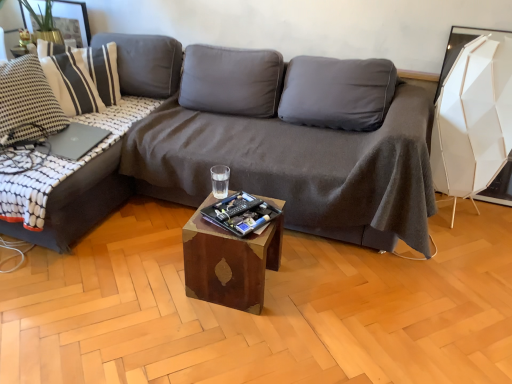
What is the approximate height of slate gray matte laptop at left?

slate gray matte laptop at left is 2.21 inches in height.

Locate an element on the screen. This screenshot has height=384, width=512. slate gray matte laptop at left is located at coordinates (73, 141).

Describe the element at coordinates (79, 202) in the screenshot. I see `dark gray fabric couch at left, the 2th studio couch when ordered from right to left` at that location.

This screenshot has height=384, width=512. I want to click on dark gray fabric couch at left, the 2th studio couch when ordered from right to left, so click(x=79, y=202).

Locate an element on the screen. The width and height of the screenshot is (512, 384). white textured pillow at upper left is located at coordinates (93, 66).

Describe the element at coordinates (229, 262) in the screenshot. This screenshot has height=384, width=512. I see `wooden cube at center` at that location.

This screenshot has width=512, height=384. I want to click on slate gray matte laptop at left, so click(73, 141).

Looking at this image, is dark gray fabric couch at left, arranged as the first studio couch when viewed from the left, positioned in front of green leafy plant at upper left?

Yes, the depth of dark gray fabric couch at left, arranged as the first studio couch when viewed from the left, is less than that of green leafy plant at upper left.

From the image's perspective, which one is positioned lower, dark gray fabric couch at left, the 2th studio couch when ordered from right to left, or green leafy plant at upper left?

From the image's view, dark gray fabric couch at left, the 2th studio couch when ordered from right to left, is below.

Considering the sizes of dark gray fabric couch at left, the 2th studio couch when ordered from right to left, and green leafy plant at upper left in the image, is dark gray fabric couch at left, the 2th studio couch when ordered from right to left, wider or thinner than green leafy plant at upper left?

Clearly, dark gray fabric couch at left, the 2th studio couch when ordered from right to left, has more width compared to green leafy plant at upper left.

Are dark gray fabric couch at left, the 2th studio couch when ordered from right to left, and white textured pillow at upper left beside each other?

No, dark gray fabric couch at left, the 2th studio couch when ordered from right to left, is not making contact with white textured pillow at upper left.

Between point (62, 251) and point (47, 42), which one is positioned behind?

The point (47, 42) is behind.

Who is bigger, dark gray fabric couch at left, the 2th studio couch when ordered from right to left, or white textured pillow at upper left?

With larger size is dark gray fabric couch at left, the 2th studio couch when ordered from right to left.

Between dark gray fabric couch at left, arranged as the first studio couch when viewed from the left, and white textured pillow at upper left, which one has more height?

With more height is dark gray fabric couch at left, arranged as the first studio couch when viewed from the left.

Considering the sizes of dark gray fabric couch at center, placed as the 1th studio couch when sorted from right to left, and slate gray matte laptop at left in the image, is dark gray fabric couch at center, placed as the 1th studio couch when sorted from right to left, taller or shorter than slate gray matte laptop at left?

dark gray fabric couch at center, placed as the 1th studio couch when sorted from right to left, is taller than slate gray matte laptop at left.

Is point (385, 62) in front of point (91, 127)?

That is False.

From a real-world perspective, relative to slate gray matte laptop at left, is dark gray fabric couch at center, placed as the 1th studio couch when sorted from right to left, vertically above or below?

From a real-world perspective, dark gray fabric couch at center, placed as the 1th studio couch when sorted from right to left, is physically below slate gray matte laptop at left.

Consider the image. Can you confirm if dark gray fabric couch at center, placed as the second studio couch when sorted from left to right, is positioned to the left of slate gray matte laptop at left?

In fact, dark gray fabric couch at center, placed as the second studio couch when sorted from left to right, is to the right of slate gray matte laptop at left.

Based on the photo, does white textured pillow at upper left touch dark gray fabric couch at left, the 2th studio couch when ordered from right to left?

They are not placed beside each other.

Which of these two, white textured pillow at upper left or dark gray fabric couch at left, arranged as the first studio couch when viewed from the left, is thinner?

Thinner between the two is white textured pillow at upper left.

Is the position of white textured pillow at upper left more distant than that of dark gray fabric couch at left, the 2th studio couch when ordered from right to left?

Yes.

Where is `studio couch that is the 1st one when counting downward from the white textured pillow at upper left (from the image's perspective)`? Image resolution: width=512 pixels, height=384 pixels. studio couch that is the 1st one when counting downward from the white textured pillow at upper left (from the image's perspective) is located at coordinates (79, 202).

Is point (239, 160) behind point (151, 92)?

That is False.

From the image's perspective, is dark gray fabric couch at center, placed as the 1th studio couch when sorted from right to left, above or below dark gray fabric couch at left, arranged as the first studio couch when viewed from the left?

Clearly, from the image's perspective, dark gray fabric couch at center, placed as the 1th studio couch when sorted from right to left, is below dark gray fabric couch at left, arranged as the first studio couch when viewed from the left.

How many degrees apart are the facing directions of dark gray fabric couch at center, placed as the second studio couch when sorted from left to right, and dark gray fabric couch at left, the 2th studio couch when ordered from right to left?

The facing directions of dark gray fabric couch at center, placed as the second studio couch when sorted from left to right, and dark gray fabric couch at left, the 2th studio couch when ordered from right to left, are 90 degrees apart.

From a real-world perspective, who is located lower, dark gray fabric couch at center, placed as the second studio couch when sorted from left to right, or dark gray fabric couch at left, the 2th studio couch when ordered from right to left?

dark gray fabric couch at left, the 2th studio couch when ordered from right to left, is physically lower.

Can you tell me how much wooden cube at center and slate gray matte laptop at left differ in facing direction?

They differ by 93.3 degrees in their facing directions.

Which is behind, wooden cube at center or slate gray matte laptop at left?

Positioned behind is slate gray matte laptop at left.

How far apart are wooden cube at center and slate gray matte laptop at left?

The distance of wooden cube at center from slate gray matte laptop at left is 94.25 centimeters.

Are wooden cube at center and slate gray matte laptop at left making contact?

wooden cube at center and slate gray matte laptop at left are not in contact.

Is slate gray matte laptop at left turned away from dark gray fabric couch at left, the 2th studio couch when ordered from right to left?

Yes.

Which object is closer to the camera, slate gray matte laptop at left or dark gray fabric couch at left, the 2th studio couch when ordered from right to left?

dark gray fabric couch at left, the 2th studio couch when ordered from right to left.

In the scene shown: From a real-world perspective, does slate gray matte laptop at left stand above dark gray fabric couch at left, the 2th studio couch when ordered from right to left?

Indeed, from a real-world perspective, slate gray matte laptop at left stands above dark gray fabric couch at left, the 2th studio couch when ordered from right to left.

From the green leafy plant at upper left, count 2nd studio couchs forward and point to it. Please provide its 2D coordinates.

[(79, 202)]

Locate an element on the screen. Image resolution: width=512 pixels, height=384 pixels. the 1st studio couch below the white textured pillow at upper left (from the image's perspective) is located at coordinates (79, 202).

When comparing their distances from white textured pillow at upper left, does green leafy plant at upper left or dark gray fabric couch at left, arranged as the first studio couch when viewed from the left, seem further?

dark gray fabric couch at left, arranged as the first studio couch when viewed from the left, is positioned further to the anchor white textured pillow at upper left.

Which object lies further to the anchor point dark gray fabric couch at center, placed as the second studio couch when sorted from left to right, dark gray fabric couch at left, the 2th studio couch when ordered from right to left, or wooden cube at center?

dark gray fabric couch at left, the 2th studio couch when ordered from right to left, lies further to dark gray fabric couch at center, placed as the second studio couch when sorted from left to right, than the other object.

Based on their spatial positions, is wooden cube at center or dark gray fabric couch at left, the 2th studio couch when ordered from right to left, closer to slate gray matte laptop at left?

dark gray fabric couch at left, the 2th studio couch when ordered from right to left, is closer to slate gray matte laptop at left.

Looking at the image, which one is located further to green leafy plant at upper left, slate gray matte laptop at left or dark gray fabric couch at left, the 2th studio couch when ordered from right to left?

dark gray fabric couch at left, the 2th studio couch when ordered from right to left, is further to green leafy plant at upper left.

Estimate the real-world distances between objects in this image. Which object is closer to dark gray fabric couch at left, the 2th studio couch when ordered from right to left, green leafy plant at upper left or slate gray matte laptop at left?

slate gray matte laptop at left is closer to dark gray fabric couch at left, the 2th studio couch when ordered from right to left.

Which object lies further to the anchor point white textured pillow at upper left, slate gray matte laptop at left or dark gray fabric couch at left, arranged as the first studio couch when viewed from the left?

Based on the image, dark gray fabric couch at left, arranged as the first studio couch when viewed from the left, appears to be further to white textured pillow at upper left.

Looking at the image, which one is located closer to green leafy plant at upper left, dark gray fabric couch at center, placed as the 1th studio couch when sorted from right to left, or white textured pillow at upper left?

The object closer to green leafy plant at upper left is white textured pillow at upper left.

Consider the image. When comparing their distances from wooden cube at center, does green leafy plant at upper left or dark gray fabric couch at left, arranged as the first studio couch when viewed from the left, seem closer?

dark gray fabric couch at left, arranged as the first studio couch when viewed from the left, is closer to wooden cube at center.

The height and width of the screenshot is (384, 512). Find the location of `laptop located between green leafy plant at upper left and dark gray fabric couch at center, placed as the second studio couch when sorted from left to right, in the left-right direction`. laptop located between green leafy plant at upper left and dark gray fabric couch at center, placed as the second studio couch when sorted from left to right, in the left-right direction is located at coordinates (73, 141).

Locate an element on the screen. The width and height of the screenshot is (512, 384). studio couch situated between white textured pillow at upper left and dark gray fabric couch at center, placed as the 1th studio couch when sorted from right to left, from left to right is located at coordinates (79, 202).

You are a GUI agent. You are given a task and a screenshot of the screen. Output one action in this format:
    pyautogui.click(x=<x>, y=<y>)
    Task: Click on the table situated between white textured pillow at upper left and dark gray fabric couch at center, placed as the second studio couch when sorted from left to right, from left to right
    This screenshot has height=384, width=512.
    Given the screenshot: What is the action you would take?
    pyautogui.click(x=229, y=262)

In order to click on table between slate gray matte laptop at left and dark gray fabric couch at center, placed as the second studio couch when sorted from left to right, in the horizontal direction in this screenshot , I will do `click(229, 262)`.